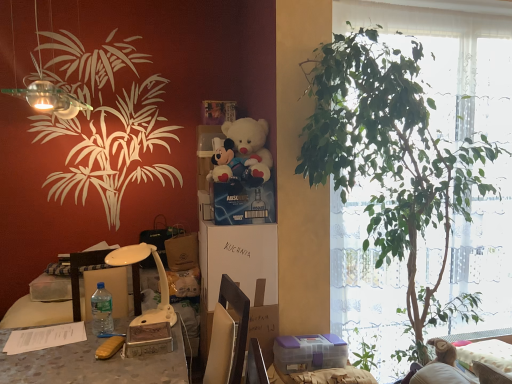
Image resolution: width=512 pixels, height=384 pixels. Find the location of `free spot above wooden box at center, which is the 4th box from back to front (from a real-world perspective)`. free spot above wooden box at center, which is the 4th box from back to front (from a real-world perspective) is located at coordinates (147, 329).